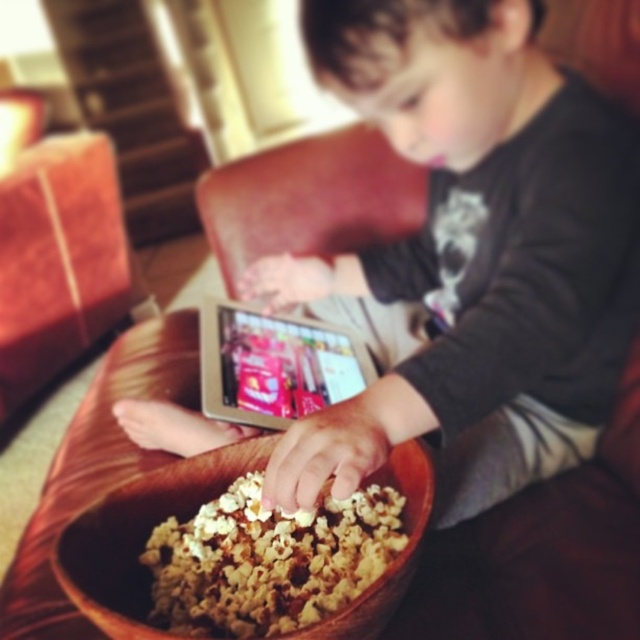
You are a photographer taking a picture of the scene. You notice the brown textured shirt at center and the silver metallic tablet at center. Where should you adjust your camera focus to ensure both objects are in the frame? The answer must use the objects description to determine the position.

Since the brown textured shirt at center is to the right of the silver metallic tablet at center, you should position your camera focus slightly to the right of the tablet to include both objects in the frame.

You are a fashion designer analyzing the image. You need to determine the exact location of the brown textured shirt at center in the image. What are its coordinates?

The brown textured shirt at center is located at coordinates point (x=472, y=253).